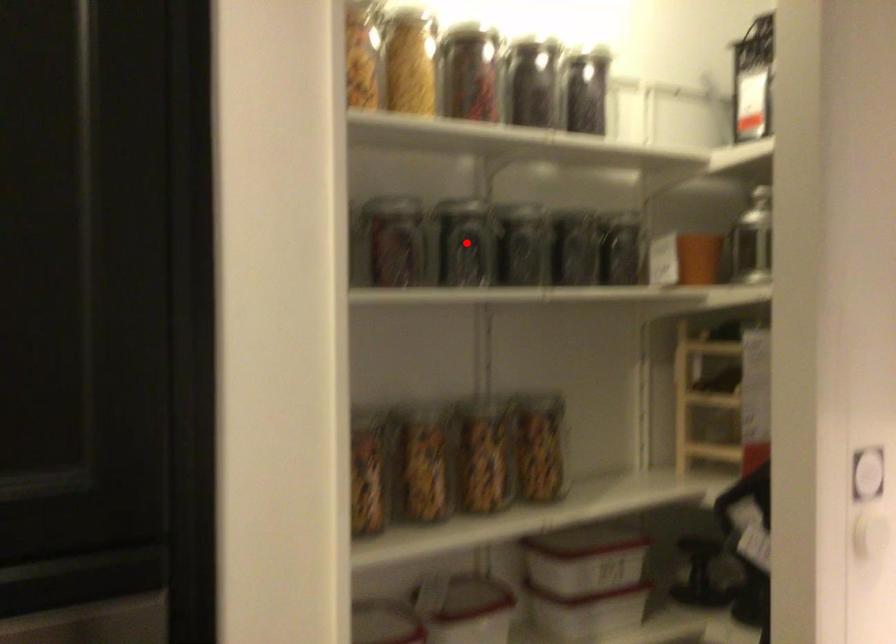
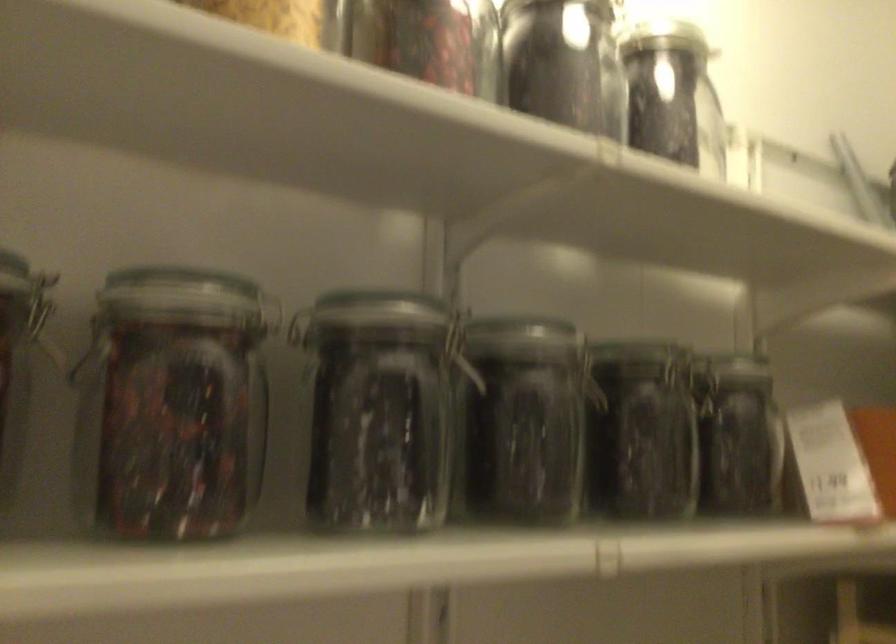
Locate, in the second image, the point that corresponds to the highlighted location in the first image.

(376, 410)